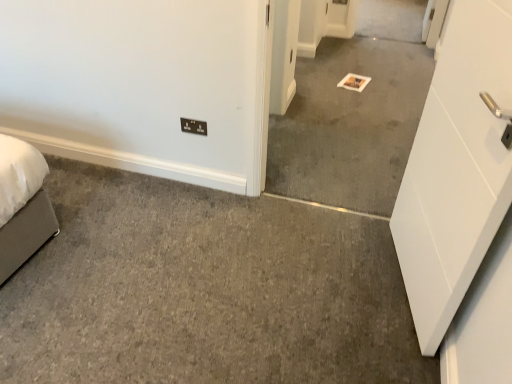
Question: Visually, is gray carpet at center positioned to the left or to the right of black plastic/light switch at lower center?

Choices:
 (A) left
 (B) right

Answer: (B)

Question: From a real-world perspective, is gray carpet at center physically located above or below black plastic/light switch at lower center?

Choices:
 (A) below
 (B) above

Answer: (B)

Question: Considering the positions of gray carpet at center and black plastic/light switch at lower center in the image, is gray carpet at center taller or shorter than black plastic/light switch at lower center?

Choices:
 (A) tall
 (B) short

Answer: (A)

Question: Is black plastic/light switch at lower center taller or shorter than gray carpet at center?

Choices:
 (A) tall
 (B) short

Answer: (B)

Question: In the image, is black plastic/light switch at lower center positioned in front of or behind gray carpet at center?

Choices:
 (A) front
 (B) behind

Answer: (B)

Question: Visually, is black plastic/light switch at lower center positioned to the left or to the right of gray carpet at center?

Choices:
 (A) right
 (B) left

Answer: (B)

Question: From the image's perspective, is black plastic/light switch at lower center located above or below gray carpet at center?

Choices:
 (A) above
 (B) below

Answer: (B)